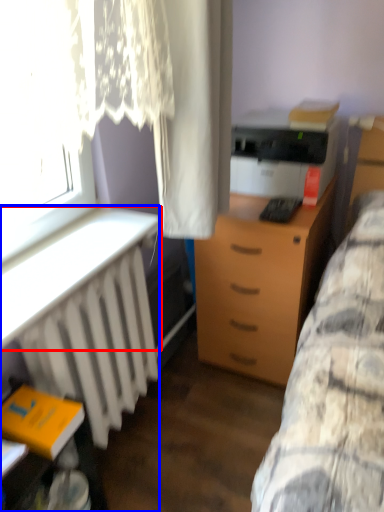
Question: Which point is further to the camera, table (highlighted by a red box) or desk (highlighted by a blue box)?

Choices:
 (A) table
 (B) desk

Answer: (B)